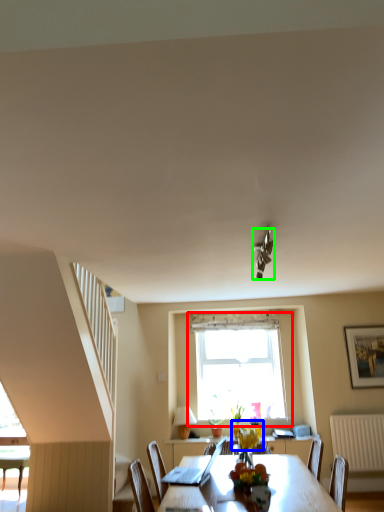
Question: Considering the real-world distances, which object is closest to window (highlighted by a red box)? flower (highlighted by a blue box) or light fixture (highlighted by a green box).

Choices:
 (A) flower
 (B) light fixture

Answer: (A)